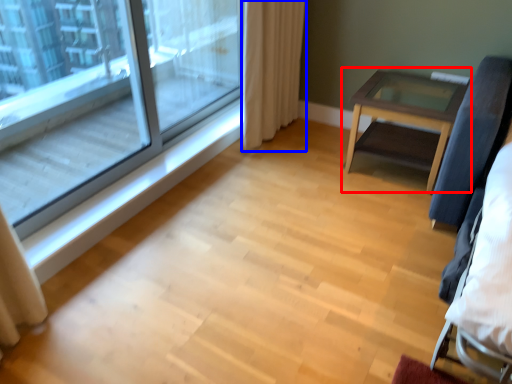
Question: Among these objects, which one is nearest to the camera, table (highlighted by a red box) or curtain (highlighted by a blue box)?

Choices:
 (A) table
 (B) curtain

Answer: (A)